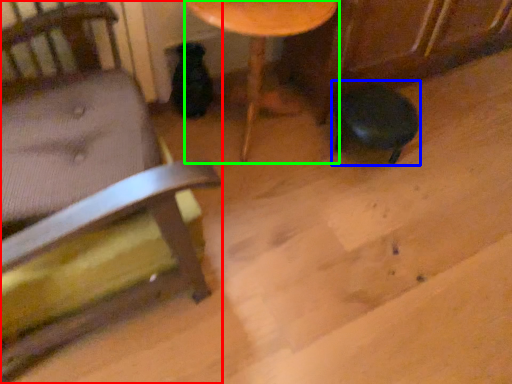
Question: Which is nearer to the chair (highlighted by a red box)? bar stool (highlighted by a blue box) or table (highlighted by a green box).

Choices:
 (A) bar stool
 (B) table

Answer: (B)